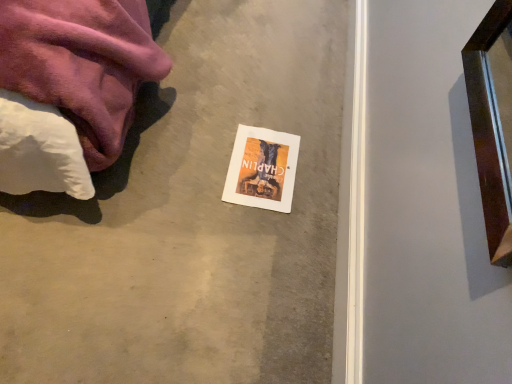
Question: Does smooth concrete at center have a larger size compared to orange matte paper flyer at center?

Choices:
 (A) yes
 (B) no

Answer: (A)

Question: Does smooth concrete at center have a lesser height compared to orange matte paper flyer at center?

Choices:
 (A) no
 (B) yes

Answer: (A)

Question: Considering the relative positions of smooth concrete at center and orange matte paper flyer at center in the image provided, is smooth concrete at center behind orange matte paper flyer at center?

Choices:
 (A) yes
 (B) no

Answer: (B)

Question: Does smooth concrete at center lie in front of orange matte paper flyer at center?

Choices:
 (A) no
 (B) yes

Answer: (B)

Question: Could you tell me if smooth concrete at center is facing orange matte paper flyer at center?

Choices:
 (A) yes
 (B) no

Answer: (B)

Question: Is smooth concrete at center not inside orange matte paper flyer at center?

Choices:
 (A) yes
 (B) no

Answer: (A)

Question: Can you confirm if orange matte paper flyer at center is shorter than smooth concrete at center?

Choices:
 (A) yes
 (B) no

Answer: (A)

Question: Is orange matte paper flyer at center oriented away from smooth concrete at center?

Choices:
 (A) yes
 (B) no

Answer: (A)

Question: Considering the relative sizes of orange matte paper flyer at center and smooth concrete at center in the image provided, is orange matte paper flyer at center bigger than smooth concrete at center?

Choices:
 (A) no
 (B) yes

Answer: (A)

Question: Is orange matte paper flyer at center completely or partially outside of smooth concrete at center?

Choices:
 (A) no
 (B) yes

Answer: (A)

Question: Is orange matte paper flyer at center closer to the viewer compared to smooth concrete at center?

Choices:
 (A) no
 (B) yes

Answer: (A)

Question: Is orange matte paper flyer at center not close to smooth concrete at center?

Choices:
 (A) yes
 (B) no

Answer: (B)

Question: In terms of width, does orange matte paper flyer at center look wider or thinner when compared to smooth concrete at center?

Choices:
 (A) wide
 (B) thin

Answer: (B)